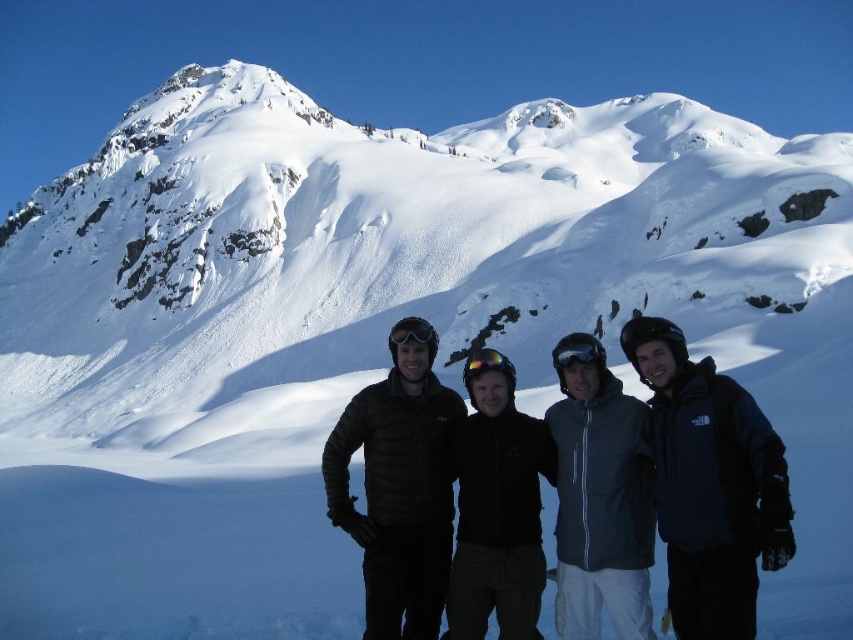
You are a photographer trying to capture a group photo of the black puffer jacket at center and the gray fleece jacket at center. Since you want to ensure both subjects are in focus, you need to know which one is taller to adjust the camera settings. Which jacket is taller?

The black puffer jacket at center is taller than the gray fleece jacket at center, so you should adjust the camera settings to focus on the taller black puffer jacket at center first.

You are standing at the origin point in the image. There is a black puffer jacket at center located at point (399,492). If you want to move towards the black puffer jacket at center, in which direction should you move?

You should move in the direction of point (399,492) to reach the black puffer jacket at center.

You are a photographer trying to capture the black puffer jacket at center in the snowy mountain landscape. Where should you position your camera to ensure the jacket is centered in the frame?

Position your camera so that the center of the frame aligns with the coordinates point (399, 492) where the black puffer jacket at center is located.